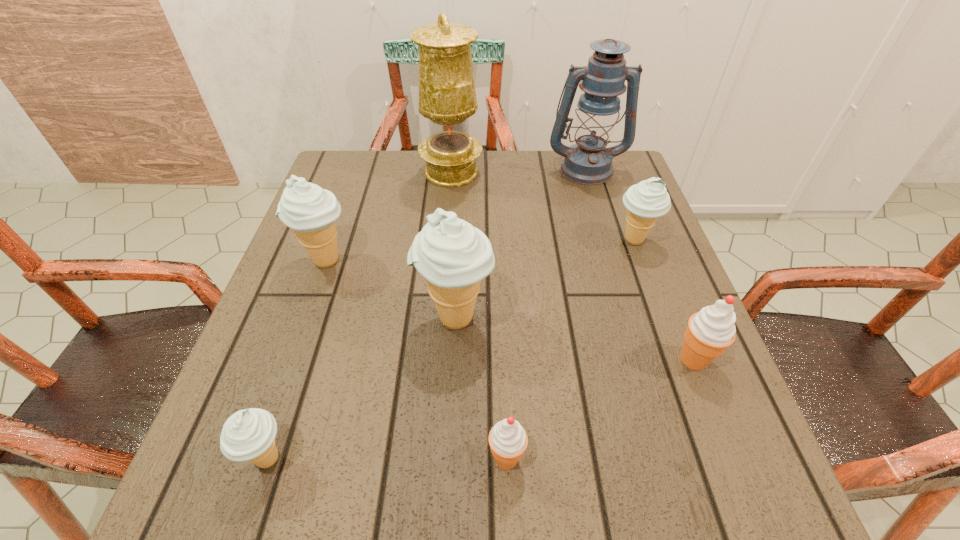
Identify the location of oil lamp. (447, 97).

You are a GUI agent. You are given a task and a screenshot of the screen. Output one action in this format:
    pyautogui.click(x=<x>, y=<y>)
    Task: Click on the lantern
    This screenshot has height=540, width=960.
    Given the screenshot: What is the action you would take?
    pyautogui.click(x=589, y=162)

The height and width of the screenshot is (540, 960). I want to click on the second beige icecream from right to left, so click(453, 256).

The image size is (960, 540). I want to click on the third tallest object, so click(x=453, y=256).

Locate an element on the screen. The image size is (960, 540). the third smallest beige icecream is located at coordinates (306, 208).

Identify the location of the second tallest icecream. The image size is (960, 540). (306, 208).

Locate an element on the screen. Image resolution: width=960 pixels, height=540 pixels. the right red icecream is located at coordinates (710, 331).

Image resolution: width=960 pixels, height=540 pixels. What are the coordinates of `the bigger red icecream` in the screenshot? It's located at (710, 331).

This screenshot has height=540, width=960. I want to click on the rightmost beige icecream, so click(646, 201).

Where is `the smaller red icecream`? The image size is (960, 540). the smaller red icecream is located at coordinates (508, 440).